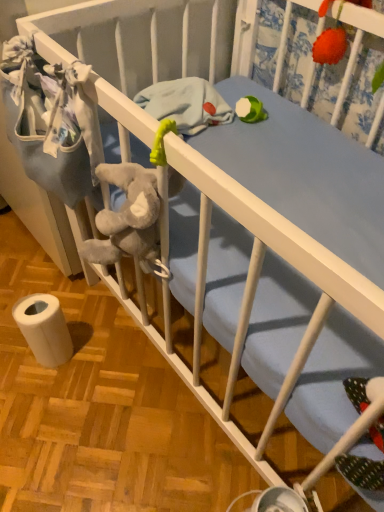
Find the location of `free space behind white matte toilet paper at lower left`. free space behind white matte toilet paper at lower left is located at coordinates (75, 304).